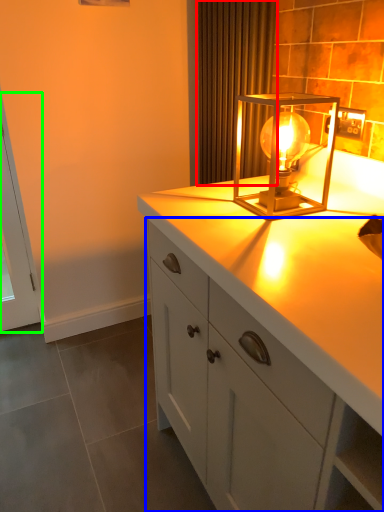
Question: Which object is positioned closest to curtain (highlighted by a red box)? Select from cabinetry (highlighted by a blue box) and screen door (highlighted by a green box).

Choices:
 (A) cabinetry
 (B) screen door

Answer: (A)